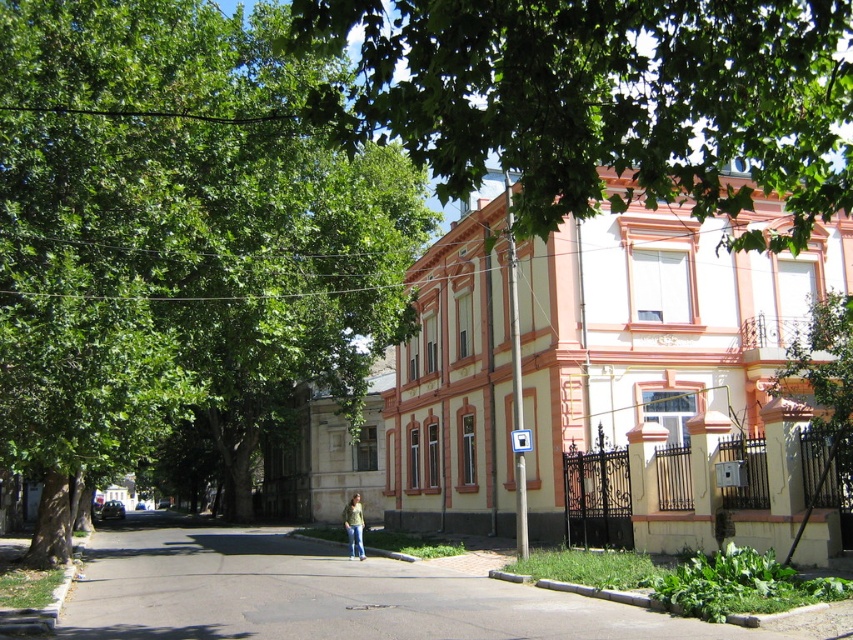
Can you confirm if green leafy tree at center is positioned below jeans at center?

Actually, green leafy tree at center is above jeans at center.

Does green leafy tree at center appear on the right side of jeans at center?

No, green leafy tree at center is not to the right of jeans at center.

Measure the distance between point (210,74) and camera.

They are 17.19 meters apart.

Locate an element on the screen. Image resolution: width=853 pixels, height=640 pixels. green leafy tree at center is located at coordinates (177, 236).

Where is `green leafy tree at center`? This screenshot has height=640, width=853. green leafy tree at center is located at coordinates (177, 236).

Is point (213, 230) more distant than point (521, 93)?

Yes, point (213, 230) is behind point (521, 93).

Which is behind, point (289, 193) or point (450, 134)?

Point (289, 193)

The image size is (853, 640). I want to click on green leafy tree at center, so click(177, 236).

Is green leafy tree at upper center taller than jeans at center?

Yes.

Is green leafy tree at upper center wider than jeans at center?

Yes.

Which is behind, point (700, 83) or point (361, 554)?

The point (361, 554) is behind.

This screenshot has height=640, width=853. Find the location of `green leafy tree at upper center`. green leafy tree at upper center is located at coordinates (602, 99).